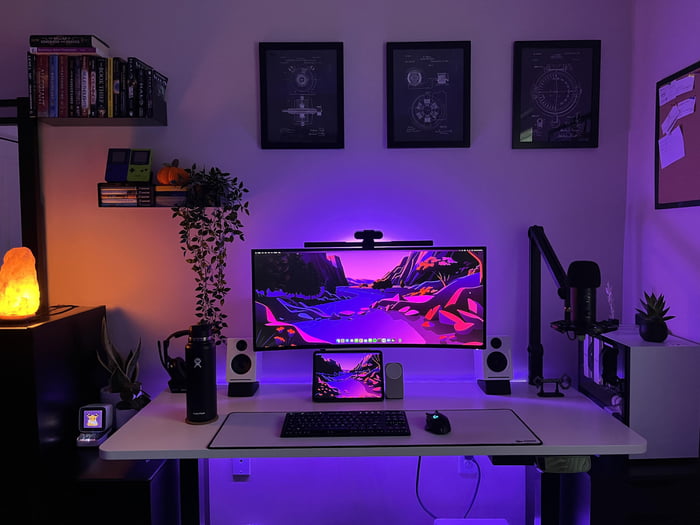
Locate an element on the screen. corkboard is located at coordinates (687, 177).